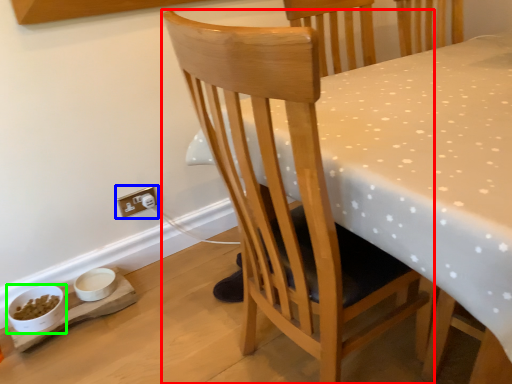
Question: Considering the real-world distances, which object is farthest from chair (highlighted by a red box)? electric outlet (highlighted by a blue box) or bowl (highlighted by a green box)?

Choices:
 (A) electric outlet
 (B) bowl

Answer: (B)